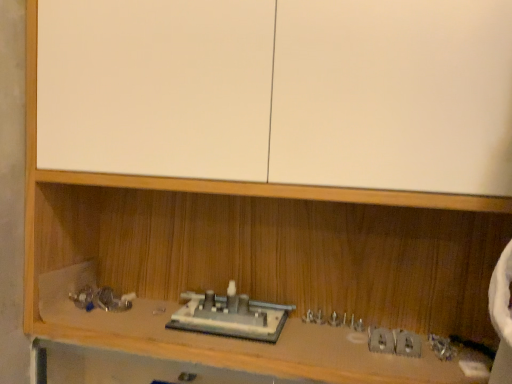
Locate an element on the screen. This screenshot has height=384, width=512. metallic gray device at center is located at coordinates (230, 315).

Describe the element at coordinates (230, 315) in the screenshot. I see `metallic gray device at center` at that location.

Where is `metallic gray device at center`? The height and width of the screenshot is (384, 512). metallic gray device at center is located at coordinates (230, 315).